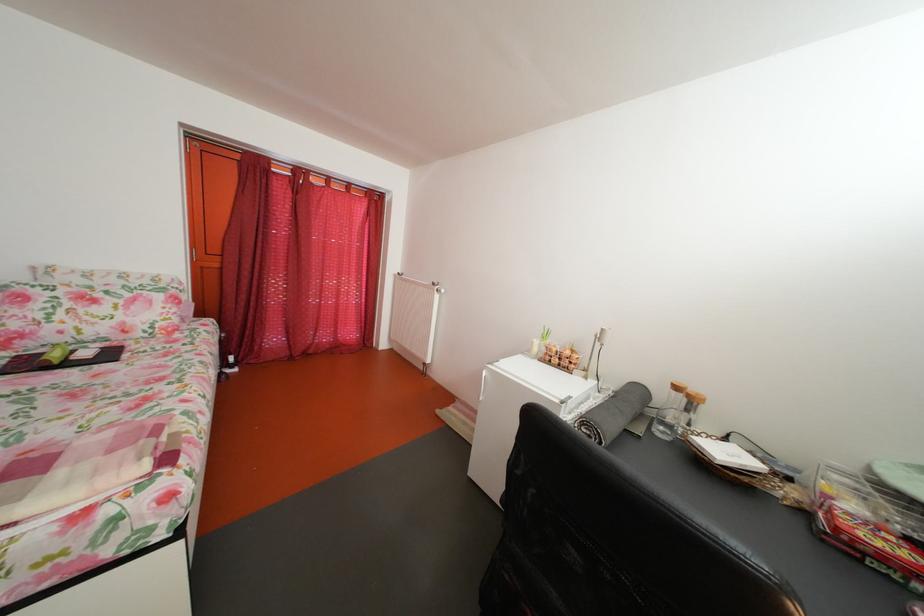
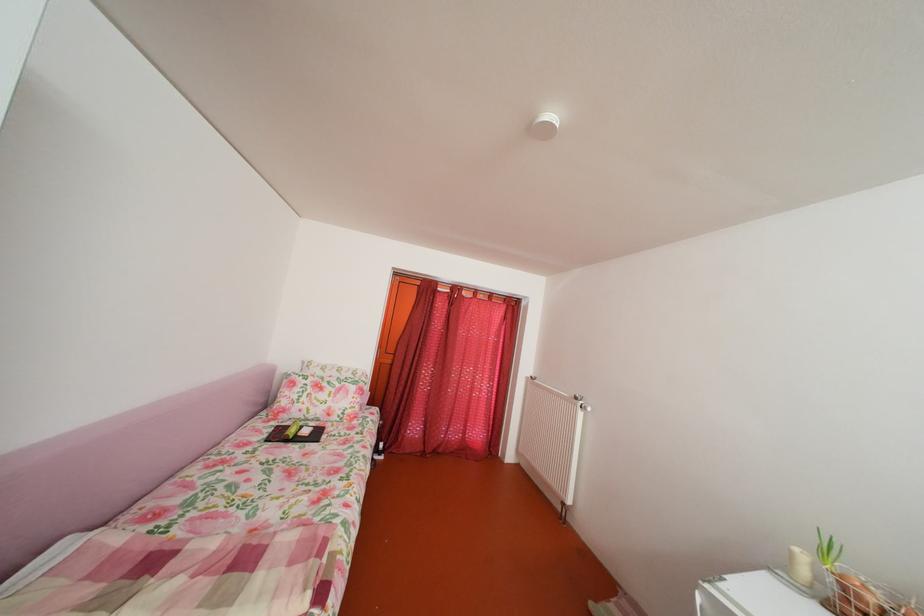
Find the pixel in the second image that matches point (565, 355) in the first image.

(882, 607)